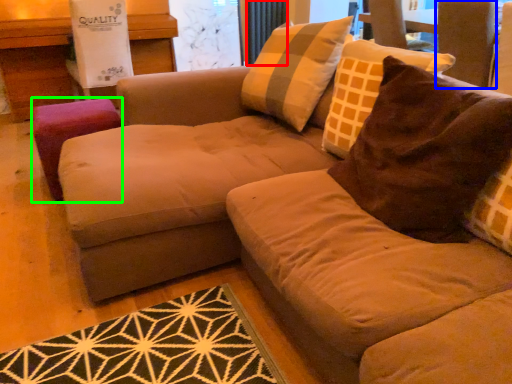
Question: Which object is the closest to the curtain (highlighted by a red box)? Choose among these: swivel chair (highlighted by a blue box) or stool (highlighted by a green box).

Choices:
 (A) swivel chair
 (B) stool

Answer: (A)